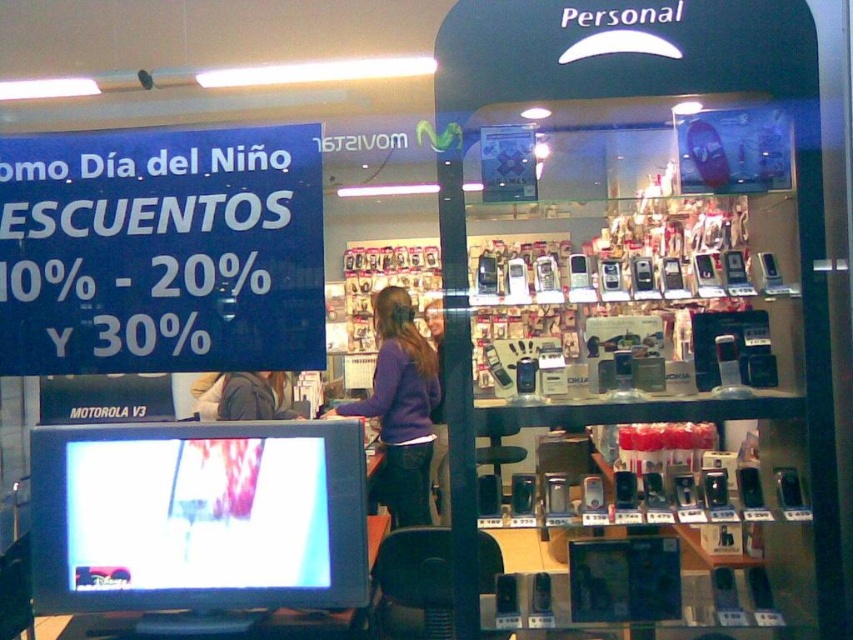
You are trying to decide which clothing item to try on first. The purple sweater at center and the dark gray jacket at center are both at the center of the image. Which one do you think will require more space when trying it on?

The purple sweater at center has a larger width than the dark gray jacket at center, so it will require more space when trying it on.

You are a customer standing at the entrance of the mobile phone shop. You see the matte black monitor at lower left and the dark gray jacket at center. Which object is nearer to you?

The matte black monitor at lower left is closer to the viewer than the dark gray jacket at center, so the matte black monitor at lower left is nearer to you.